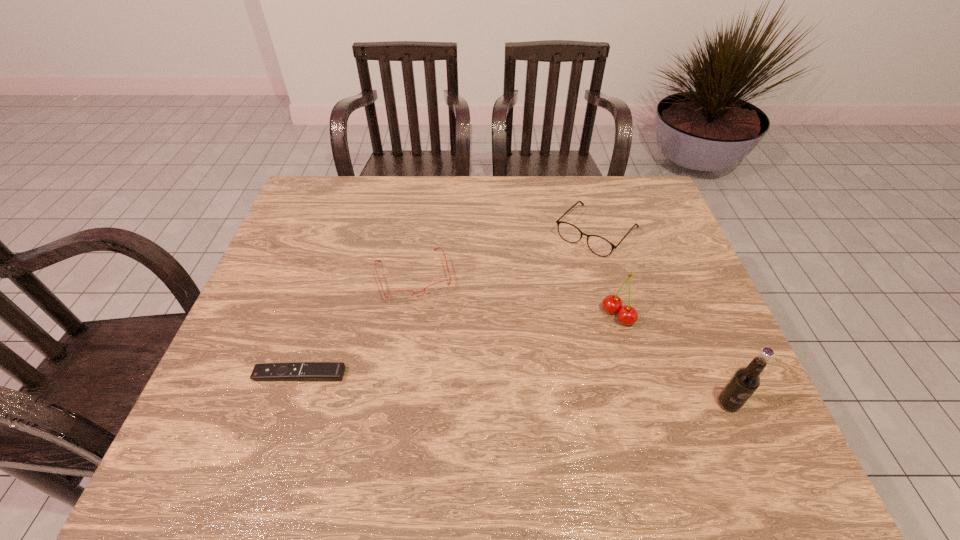
Where is `free space at the left edge of the desktop`? free space at the left edge of the desktop is located at coordinates (282, 297).

I want to click on free region at the right edge, so click(x=683, y=282).

Image resolution: width=960 pixels, height=540 pixels. I want to click on vacant space at the far left corner of the desktop, so click(354, 186).

Locate an element on the screen. The height and width of the screenshot is (540, 960). vacant point located between the second tallest object and the shorter spectacles is located at coordinates (516, 295).

You are a GUI agent. You are given a task and a screenshot of the screen. Output one action in this format:
    pyautogui.click(x=<x>, y=<y>)
    Task: Click on the free point between the third tallest object and the cherry
    The height and width of the screenshot is (540, 960).
    Given the screenshot: What is the action you would take?
    pyautogui.click(x=607, y=274)

Locate an element on the screen. Image resolution: width=960 pixels, height=540 pixels. free space between the nearest object and the fourth shortest object is located at coordinates point(673,359).

Image resolution: width=960 pixels, height=540 pixels. Find the location of `free spot between the second nearest object and the shorter spectacles`. free spot between the second nearest object and the shorter spectacles is located at coordinates (356, 325).

The width and height of the screenshot is (960, 540). Identify the location of free space between the cherry and the nearest object. (673, 359).

Locate an element on the screen. free space between the root beer and the fourth shortest object is located at coordinates (673, 359).

Locate an element on the screen. The width and height of the screenshot is (960, 540). free space between the fourth object from right to left and the second tallest object is located at coordinates (516, 295).